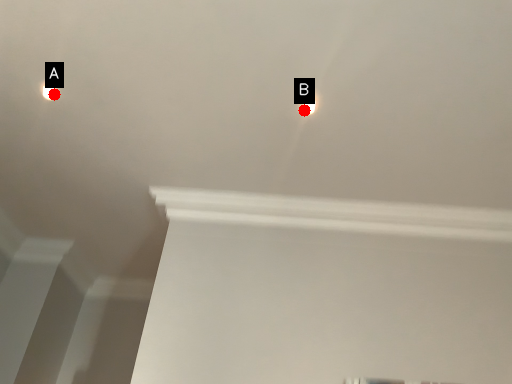
Question: Two points are circled on the image, labeled by A and B beside each circle. Which of the following is the farthest from the observer?

Choices:
 (A) A is further
 (B) B is further

Answer: (A)